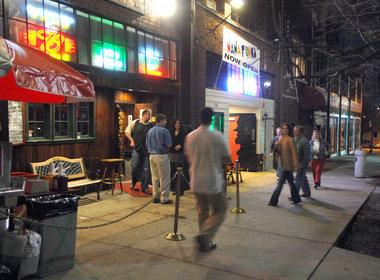
Identify the location of covered trash can. The height and width of the screenshot is (280, 380). (359, 166).